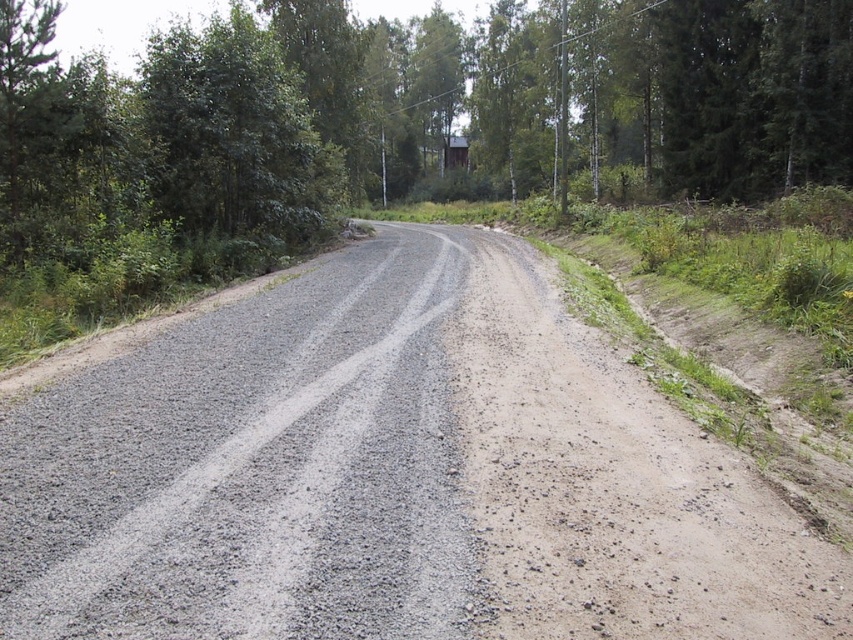
Is green leafy tree at center thinner than green leafy tree at upper left?

Yes.

Is point (294, 176) positioned before point (216, 193)?

No, it is not.

At what (x,y) coordinates should I click in order to perform the action: click on green leafy tree at center. Please return your answer as a coordinate pair (x, y). Looking at the image, I should click on (410, 109).

You are a GUI agent. You are given a task and a screenshot of the screen. Output one action in this format:
    pyautogui.click(x=<x>, y=<y>)
    Task: Click on the green leafy tree at center
    This screenshot has height=640, width=853.
    Given the screenshot: What is the action you would take?
    pyautogui.click(x=410, y=109)

Based on the photo, which is below, gray gravel road at center or green leafy tree at upper left?

gray gravel road at center is below.

Does gray gravel road at center have a larger size compared to green leafy tree at upper left?

No.

What do you see at coordinates (393, 476) in the screenshot? The width and height of the screenshot is (853, 640). I see `gray gravel road at center` at bounding box center [393, 476].

Where is `gray gravel road at center`? gray gravel road at center is located at coordinates tap(393, 476).

Can you confirm if gray gravel road at center is bigger than green leafy tree at center?

No.

Is gray gravel road at center positioned at the back of green leafy tree at center?

No, gray gravel road at center is closer to the viewer.

Between point (744, 467) and point (265, 144), which one is positioned in front?

Point (744, 467) is more forward.

This screenshot has width=853, height=640. I want to click on gray gravel road at center, so click(x=393, y=476).